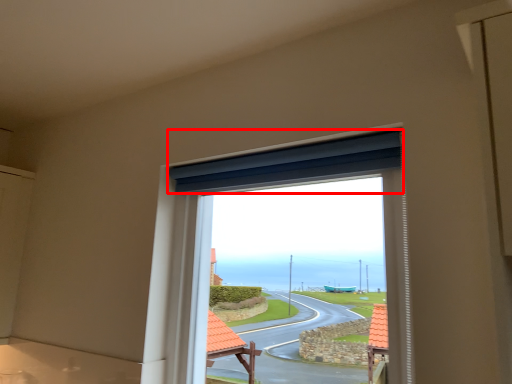
Question: From the image's perspective, where is curtain (annotated by the red box) located relative to window?

Choices:
 (A) below
 (B) above

Answer: (B)